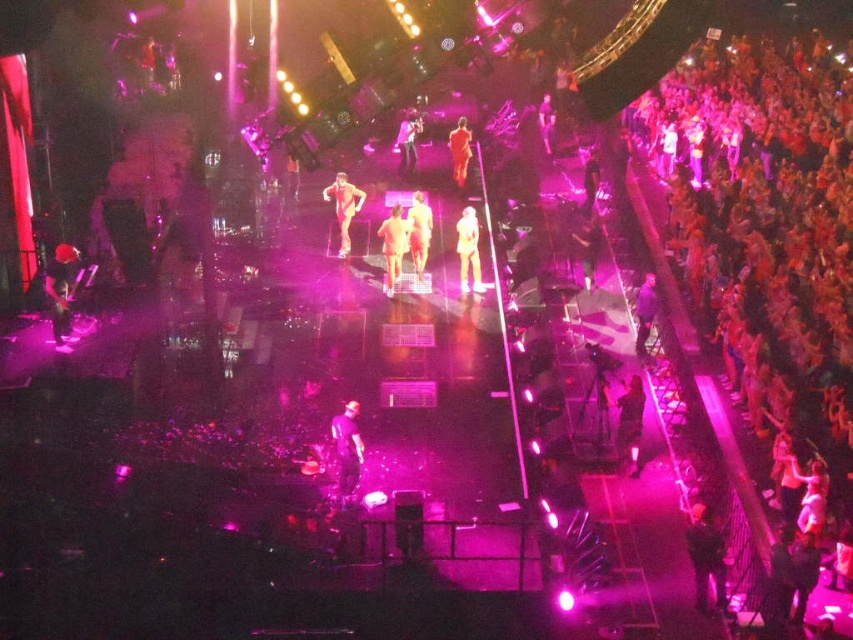
You are a photographer positioned at the center of the stage. You want to take a photo of the performers in bright orange outfits at center stage. The matte black camera at right is your only equipment. Can you use it to capture the performers without moving it?

The matte black camera at right is located at point (645, 310), so yes, you can use it to capture the performers in bright orange outfits at center stage as it is positioned on the right side of the stage and can likely capture the central area.

You are a stagehand positioned at the back of the stage. You need to retrieve an item from one of two points on the stage. The first point is at coordinates point (711,554), and the second is at point (341,429). Which point is closer to you?

Point (341,429) is closer to you because it is behind point (711,554). Since you are at the back of the stage, the point further back would be nearer to your position.

You are a stagehand who needs to move a 10 meter long equipment from the back of the stage to the front. The shiny black pants at center are in the way. Can you move the equipment without disturbing them?

The shiny black pants at center are 13.28 meters away from the equipment, so yes, the equipment can be moved without disturbing them since the distance is sufficient.